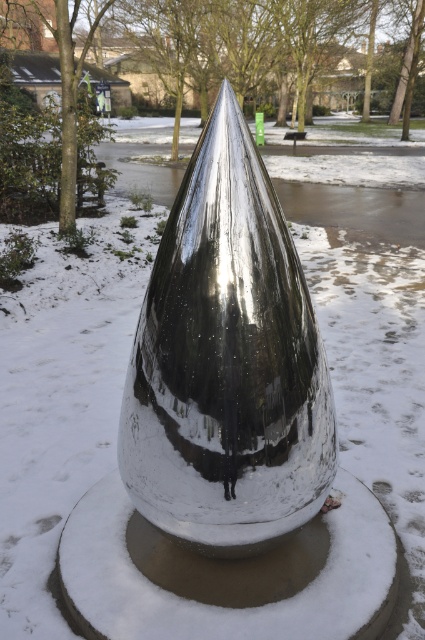
You are standing in the park and want to take a photo of the sculpture. If you move closer by 3 inches, will the point at coordinates point (193,516) become larger in your photo?

The point at coordinates point (193,516) is currently 7.18 inches from the viewer. Moving closer by 3 inches would reduce the distance to 4.18 inches, making the point appear larger in the photo.

You are standing in the park looking at the sculpture. There are two points marked on the sculpture, one at coordinates point (22, 108) and the other at point (34, 173). Which point is closer to you?

Point (22, 108) is closer to you because it is further to the viewer than point (34, 173).

You are an artist planning to photograph the shiny metallic cone at center and the brown wood tree at left. Which object will appear taller in the reflection of a nearby pond?

The brown wood tree at left will appear taller in the reflection because the shiny metallic cone at center is not as tall as the brown wood tree at left.